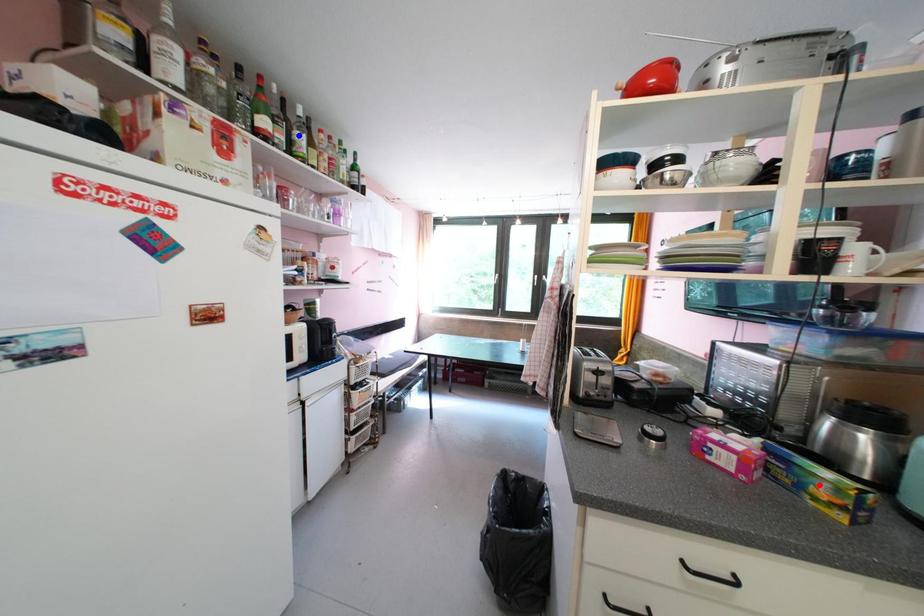
Question: In the image, two points are highlighted. Which point is nearer to the camera? Reply with the corresponding letter.

Choices:
 (A) blue point
 (B) red point

Answer: (B)